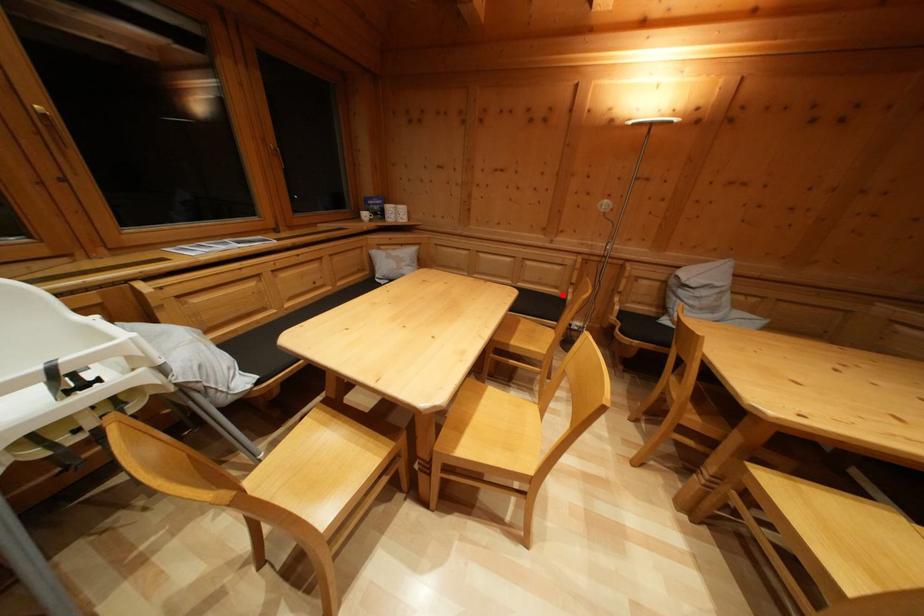
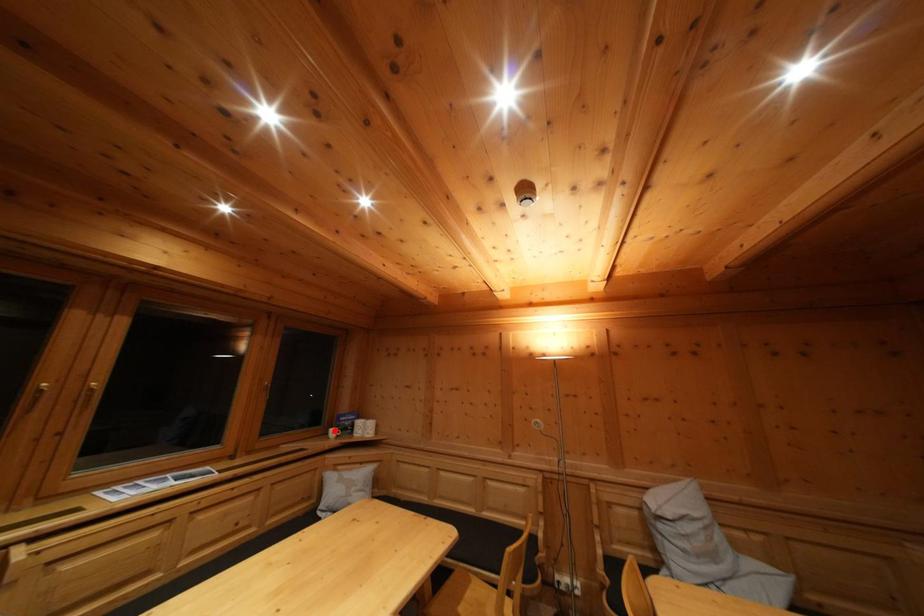
I am providing you with two images of the same scene from different viewpoints. A red point is marked on the first image and another point is marked on the second image. Is the marked point in image1 the same physical position as the marked point in image2?

→ No